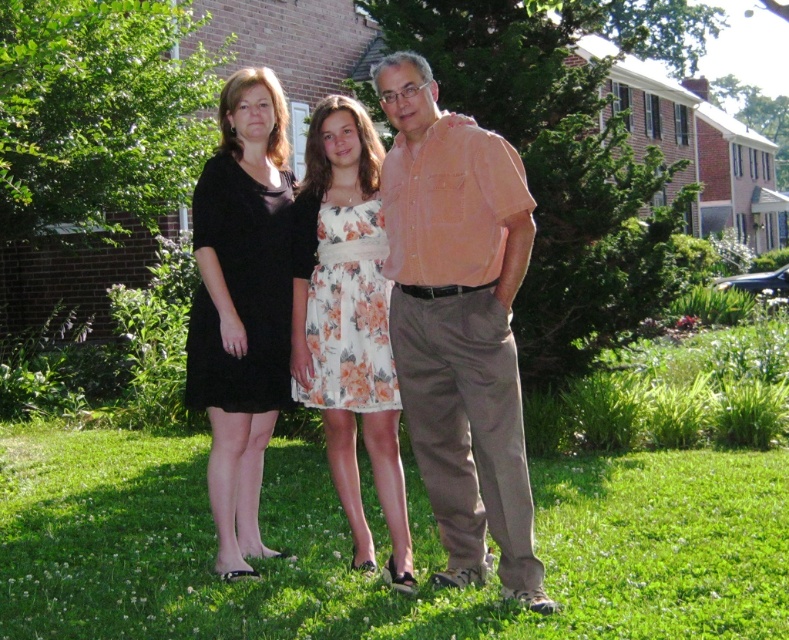
Does light orange cotton shirt at center have a greater width compared to floral dress at center?

Correct, the width of light orange cotton shirt at center exceeds that of floral dress at center.

Which is in front, point (436, 259) or point (353, 387)?

Point (436, 259) is more forward.

The image size is (789, 640). Find the location of `light orange cotton shirt at center`. light orange cotton shirt at center is located at coordinates (458, 323).

From the picture: Is green grass at center wider than floral dress at center?

Indeed, green grass at center has a greater width compared to floral dress at center.

Is green grass at center in front of floral dress at center?

That is False.

What do you see at coordinates (376, 573) in the screenshot?
I see `green grass at center` at bounding box center [376, 573].

I want to click on green grass at center, so click(376, 573).

In the scene shown: Which of these two, green grass at center or black matte dress at center, stands shorter?

With less height is green grass at center.

Is point (705, 515) more distant than point (234, 538)?

Yes.

Where is `green grass at center`? green grass at center is located at coordinates (376, 573).

The image size is (789, 640). Identify the location of green grass at center. (376, 573).